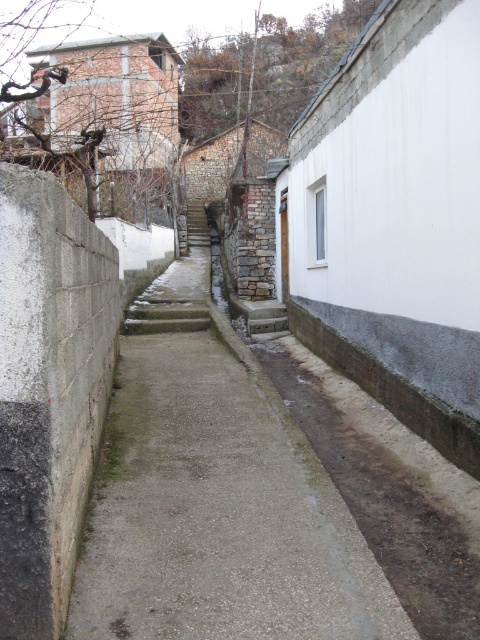
You are standing at the entrance of the alley and want to determine the distance between two points marked in the image. The first point is at coordinate point(121, 499) and the second is at point(199, 202). Based on the scene description, which point is closer to you?

Point(121, 499) is closer to the viewer than point(199, 202).